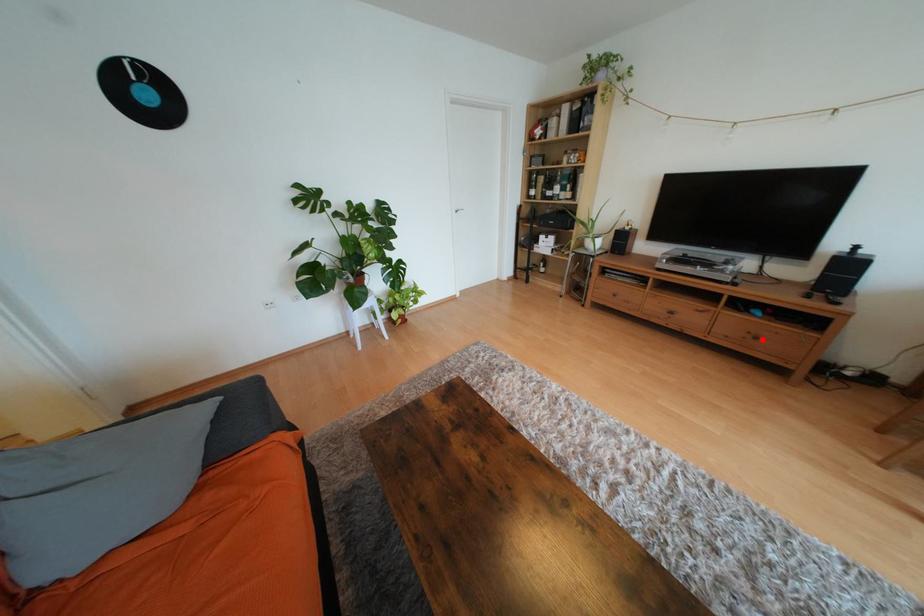
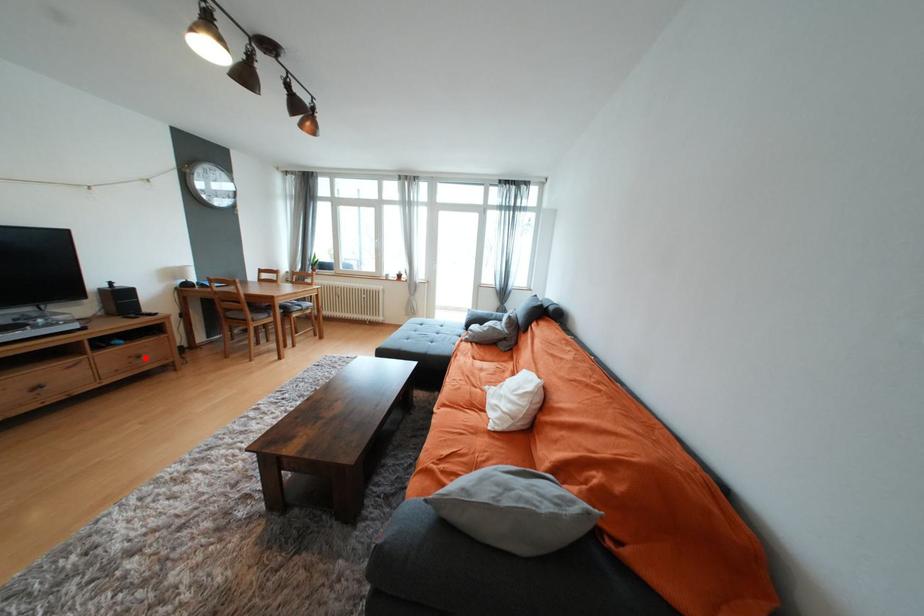
I am providing you with two images of the same scene from different viewpoints. A red point is marked on the first image and another point is marked on the second image. Is the red point in image1 aligned with the point shown in image2?

Yes